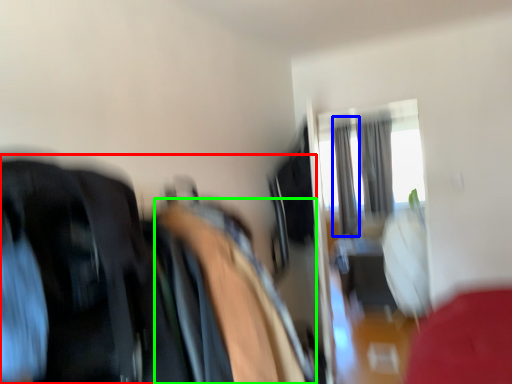
Question: Based on their relative distances, which object is farther from laundry (highlighted by a red box)? Choose from curtain (highlighted by a blue box) and bean bag chair (highlighted by a green box).

Choices:
 (A) curtain
 (B) bean bag chair

Answer: (A)